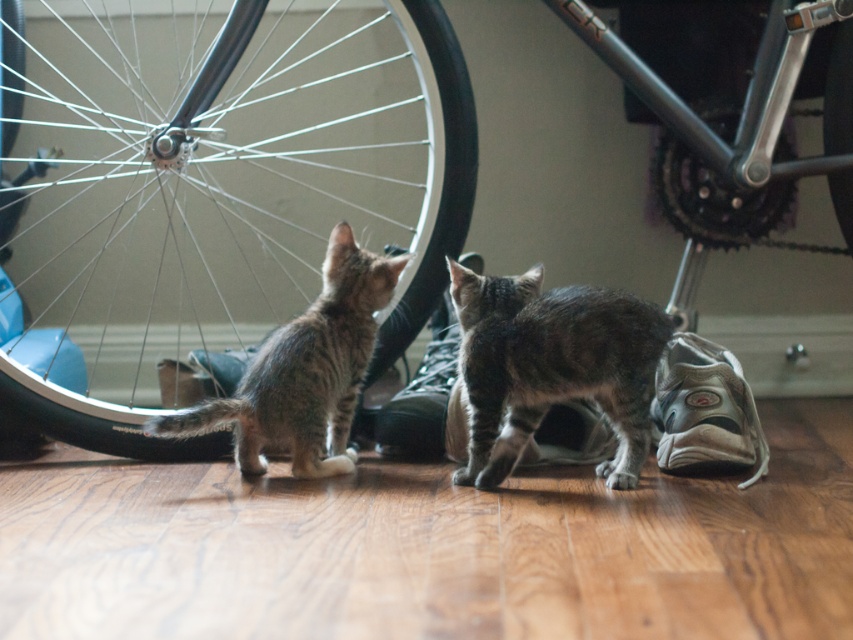
You are a photographer trying to capture the gray tabby cat at center and the brushed metal wheel at center in the same frame. Based on their positions, which object is closer to the left edge of the photo?

The gray tabby cat at center is positioned on the left side of the brushed metal wheel at center, so it is closer to the left edge of the photo.

You are a cat owner trying to locate your kitten. You see the point at coordinates (x=210, y=189) in the image. What object is located at that point?

The point at coordinates (x=210, y=189) corresponds to the metallic silver wheel at upper left.

Consider the image. You are a cat trying to reach the brushed metal wheel at center. There is a white mesh shoe at lower right in your way. Which direction should you move to go around the obstacle?

The white mesh shoe at lower right is to the left of the brushed metal wheel at center. To go around the obstacle, you should move to the right side of the white mesh shoe at lower right to reach the brushed metal wheel at center.